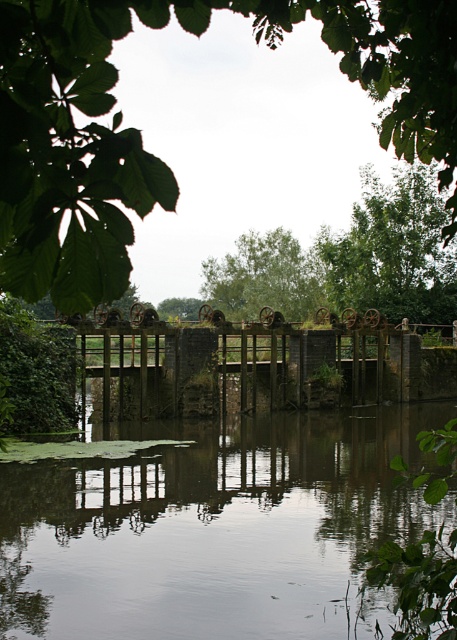
Question: Which object is the closest to the green leafy tree at upper center?

Choices:
 (A) smooth reflective water at center
 (B) rusty metal fence at center

Answer: (A)

Question: Which of these objects is positioned farthest from the rusty metal fence at center?

Choices:
 (A) green leafy tree at center
 (B) green leafy tree at upper center
 (C) smooth reflective water at center

Answer: (A)

Question: Which point is farther from the camera taking this photo?

Choices:
 (A) (51, 54)
 (B) (31, 525)

Answer: (B)

Question: Considering the relative positions of smooth reflective water at center and green leafy tree at center in the image provided, where is smooth reflective water at center located with respect to green leafy tree at center?

Choices:
 (A) above
 (B) below

Answer: (B)

Question: Can you confirm if smooth reflective water at center is positioned below green leafy tree at center?

Choices:
 (A) no
 (B) yes

Answer: (B)

Question: Can you confirm if smooth reflective water at center is positioned to the left of green leafy tree at center?

Choices:
 (A) no
 (B) yes

Answer: (B)